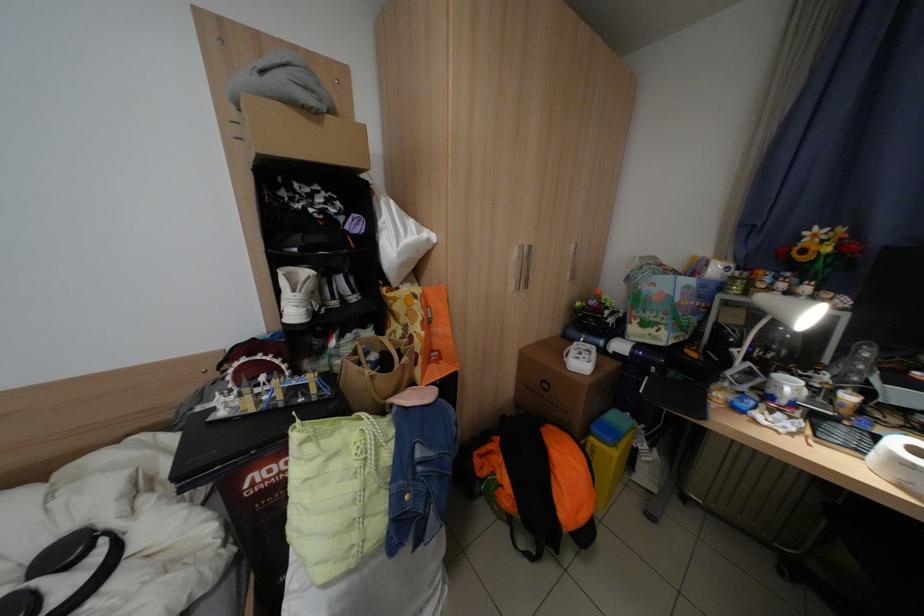
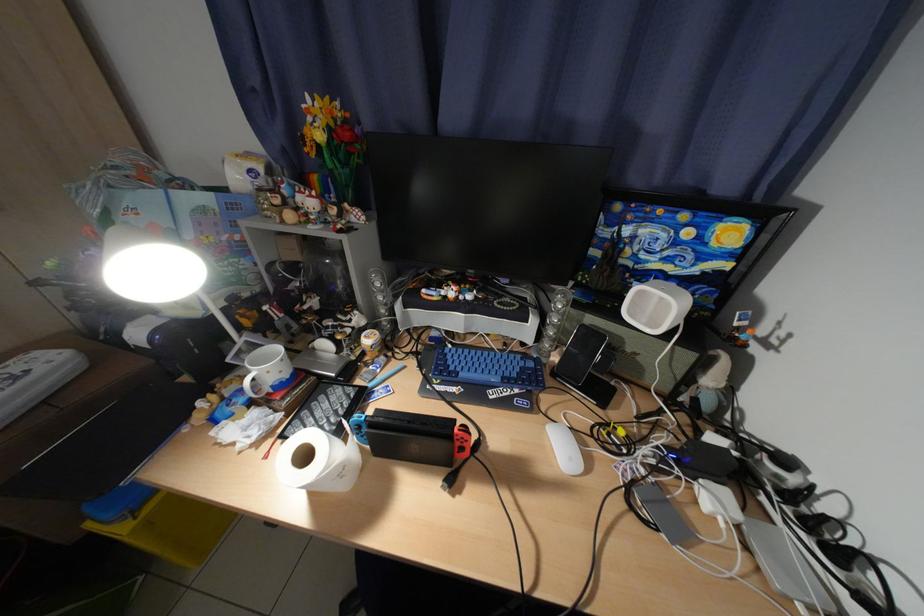
Locate, in the second image, the point that corresponds to (x=811, y=439) in the first image.

(282, 444)